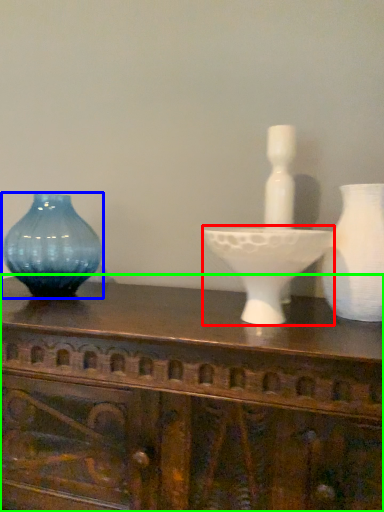
Question: Which object is the closest to the candle holder (highlighted by a red box)? Choose among these: vase (highlighted by a blue box) or table (highlighted by a green box).

Choices:
 (A) vase
 (B) table

Answer: (B)